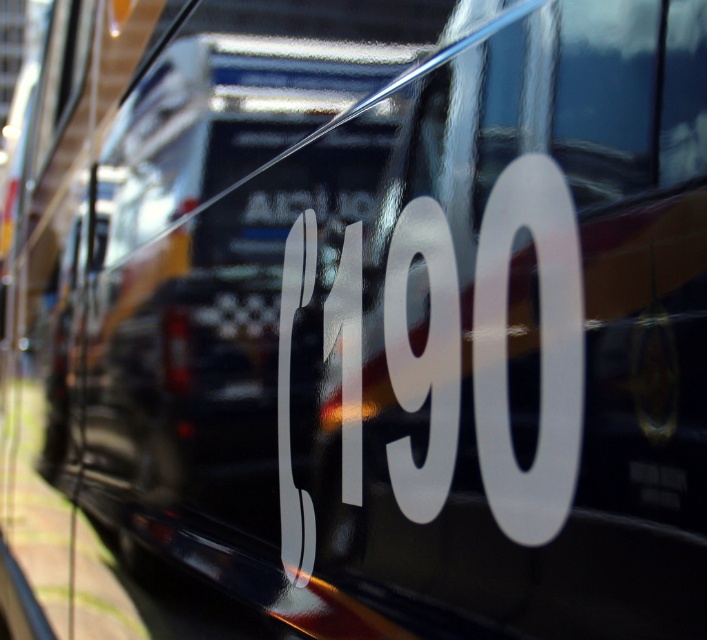
Can you confirm if glossy black number at center is positioned above white glossy number at center?

Yes.

Does glossy black number at center have a lesser height compared to white glossy number at center?

No, glossy black number at center is not shorter than white glossy number at center.

The width and height of the screenshot is (707, 640). What do you see at coordinates (216, 252) in the screenshot?
I see `glossy black number at center` at bounding box center [216, 252].

Identify the location of glossy black number at center. (216, 252).